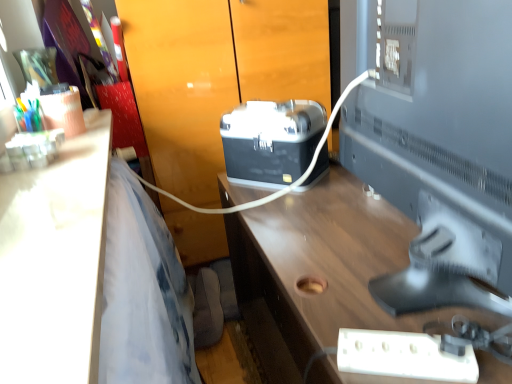
The height and width of the screenshot is (384, 512). I want to click on free point to the right of white plastic extension cord at lower right, so click(x=474, y=334).